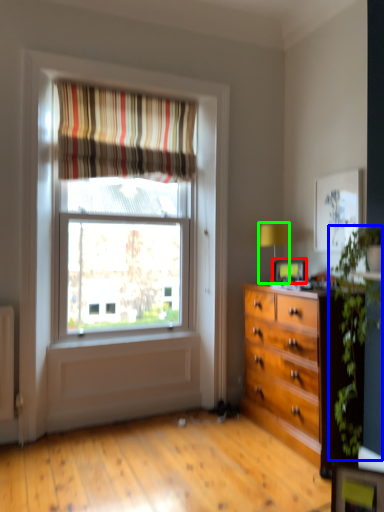
Question: Which is farther away from picture frame (highlighted by a red box)? plant (highlighted by a blue box) or table lamp (highlighted by a green box)?

Choices:
 (A) plant
 (B) table lamp

Answer: (A)